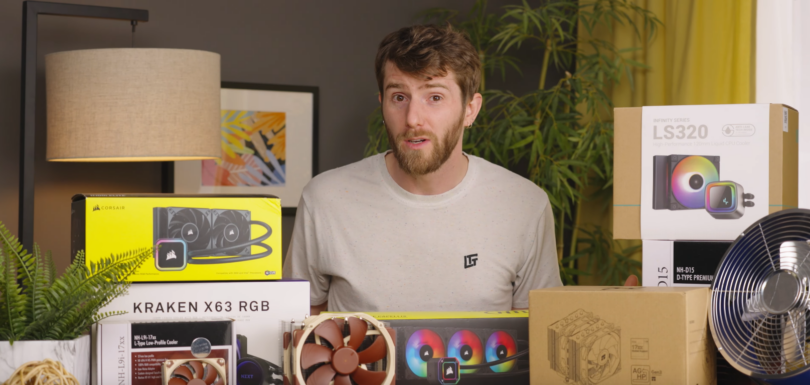
Where is `tan lamp shade`? tan lamp shade is located at coordinates (172, 125).